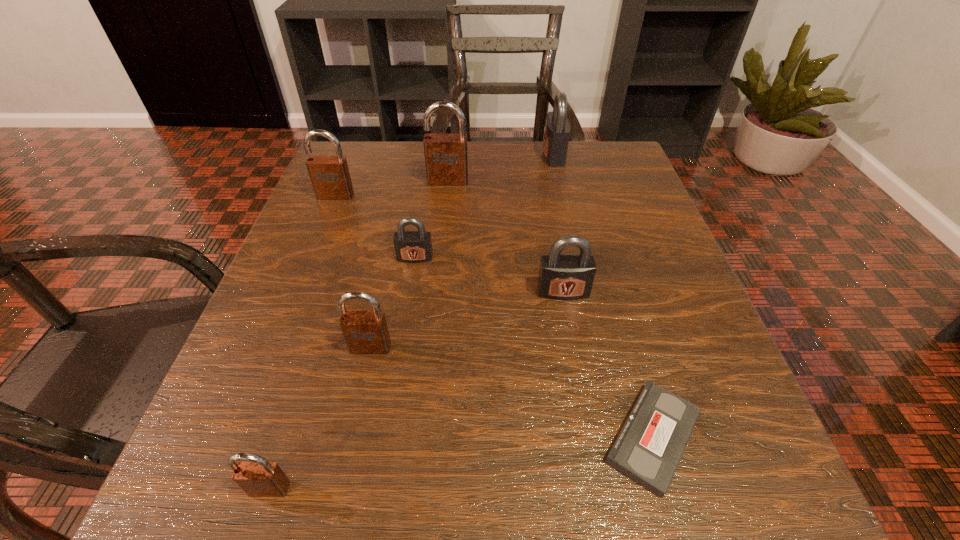
This screenshot has width=960, height=540. I want to click on the leftmost gray padlock, so click(x=410, y=246).

The height and width of the screenshot is (540, 960). Find the location of `the smallest gray padlock`. the smallest gray padlock is located at coordinates (410, 246).

Locate an element on the screen. This screenshot has width=960, height=540. the third brown padlock from right to left is located at coordinates (258, 478).

The width and height of the screenshot is (960, 540). Find the location of `the nearest brown padlock`. the nearest brown padlock is located at coordinates (258, 478).

Where is `videotape`? This screenshot has width=960, height=540. videotape is located at coordinates (650, 445).

At what (x,y) coordinates should I click in order to perform the action: click on vacant space located 0.220m on the front-facing side of the farthest brown padlock. Please return your answer as a coordinate pair (x, y). The width and height of the screenshot is (960, 540). Looking at the image, I should click on (442, 252).

I want to click on blank space located 0.270m on the front of the farthest padlock near the keyhole, so click(430, 155).

Identify the location of free space located 0.310m on the front of the farthest padlock near the keyhole. The height and width of the screenshot is (540, 960). (413, 155).

Image resolution: width=960 pixels, height=540 pixels. What are the coordinates of `vacant space positioned on the front of the farthest padlock near the keyhole` in the screenshot? It's located at (500, 155).

Where is `free spot located 0.190m on the front-facing side of the sixth nearest object`? Image resolution: width=960 pixels, height=540 pixels. free spot located 0.190m on the front-facing side of the sixth nearest object is located at coordinates (309, 261).